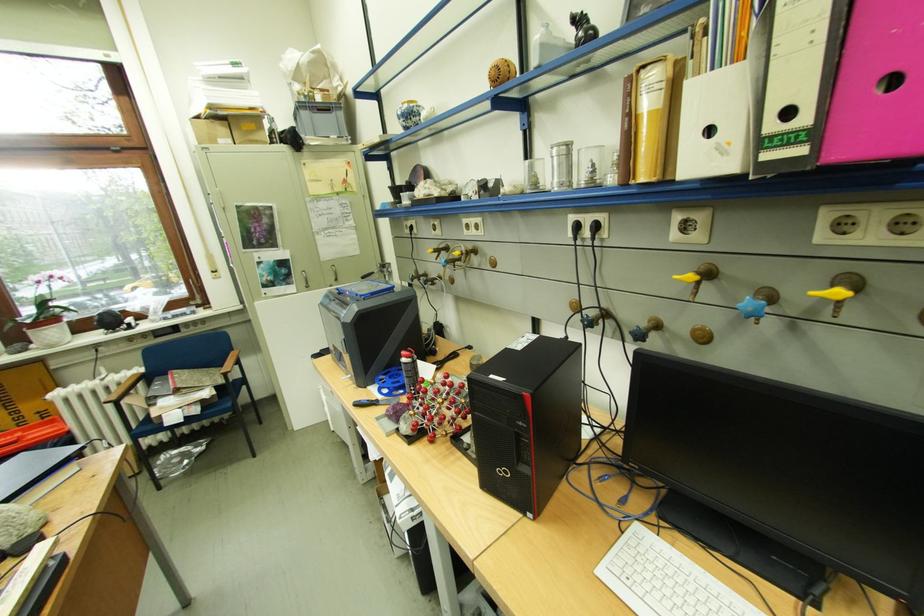
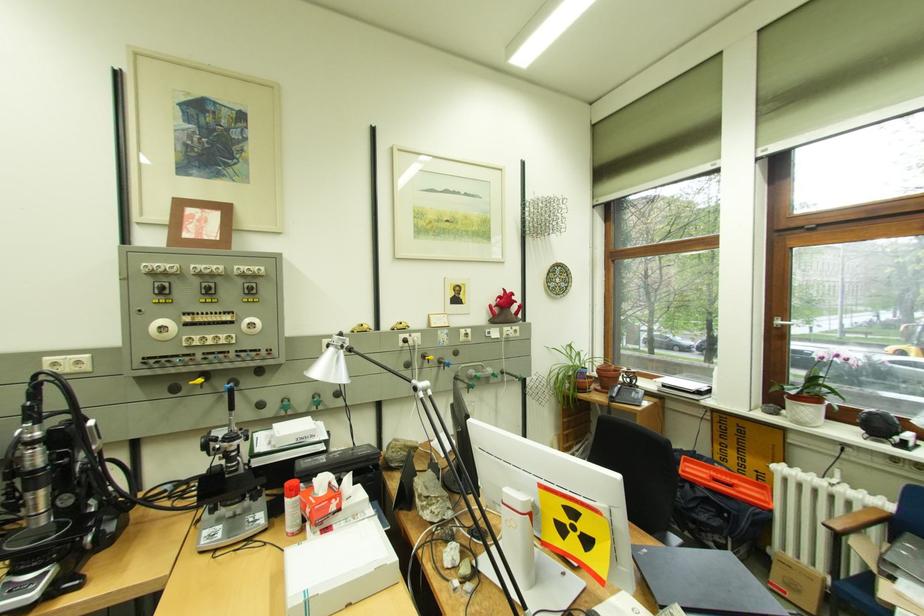
Question: The images are taken continuously from a first-person perspective. In which direction is your viewpoint rotating?

Choices:
 (A) Left
 (B) Right
 (C) Up
 (D) Down

Answer: (A)